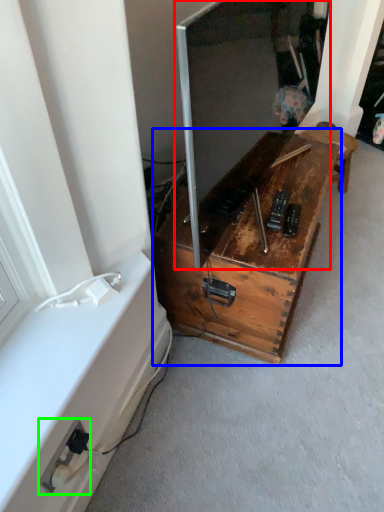
Question: Which object is positioned closest to window screen (highlighted by a red box)? Select from furniture (highlighted by a blue box) and electric outlet (highlighted by a green box).

Choices:
 (A) furniture
 (B) electric outlet

Answer: (A)